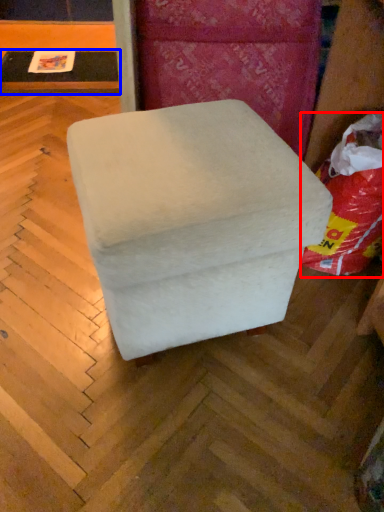
Question: Which object is closer to the camera taking this photo, bean bag chair (highlighted by a red box) or table (highlighted by a blue box)?

Choices:
 (A) bean bag chair
 (B) table

Answer: (A)